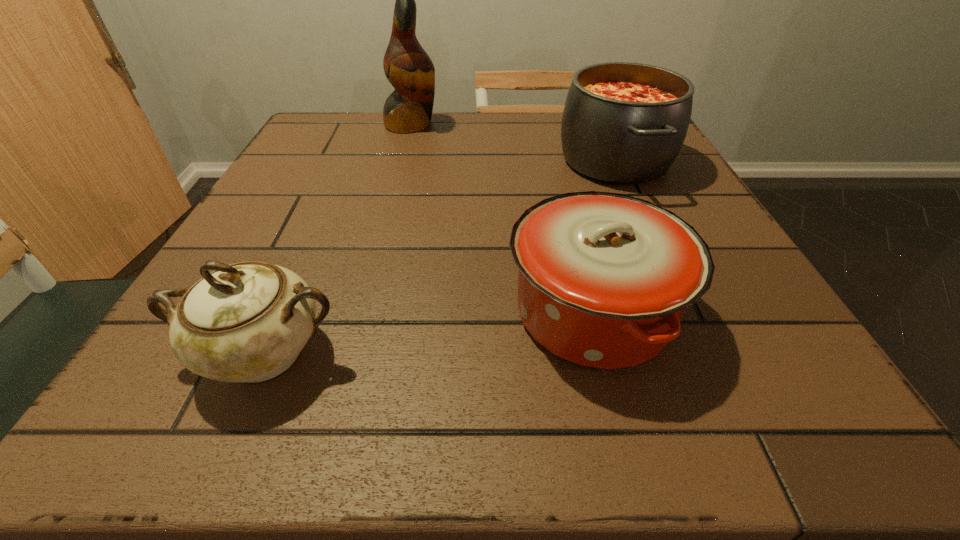
Where is `chinaware at the near edge`? This screenshot has height=540, width=960. chinaware at the near edge is located at coordinates (248, 321).

What are the coordinates of `casserole positioned at the near edge` in the screenshot? It's located at (604, 278).

The width and height of the screenshot is (960, 540). I want to click on object that is positioned at the left edge, so click(248, 321).

Image resolution: width=960 pixels, height=540 pixels. Identify the location of object that is at the near left corner. tap(248, 321).

The height and width of the screenshot is (540, 960). I want to click on object that is at the far right corner, so click(x=625, y=123).

The width and height of the screenshot is (960, 540). Identify the location of object that is at the near right corner. (604, 278).

At what (x,y) coordinates should I click in order to perform the action: click on vacant space at the far edge of the desktop. Please return your answer as a coordinate pair (x, y). This screenshot has height=540, width=960. Looking at the image, I should click on (547, 118).

Identify the location of free location at the left edge of the desktop. The image size is (960, 540). (277, 172).

Locate an element on the screen. Image resolution: width=960 pixels, height=540 pixels. vacant space at the right edge is located at coordinates (701, 225).

Locate an element on the screen. free location at the far left corner is located at coordinates (373, 117).